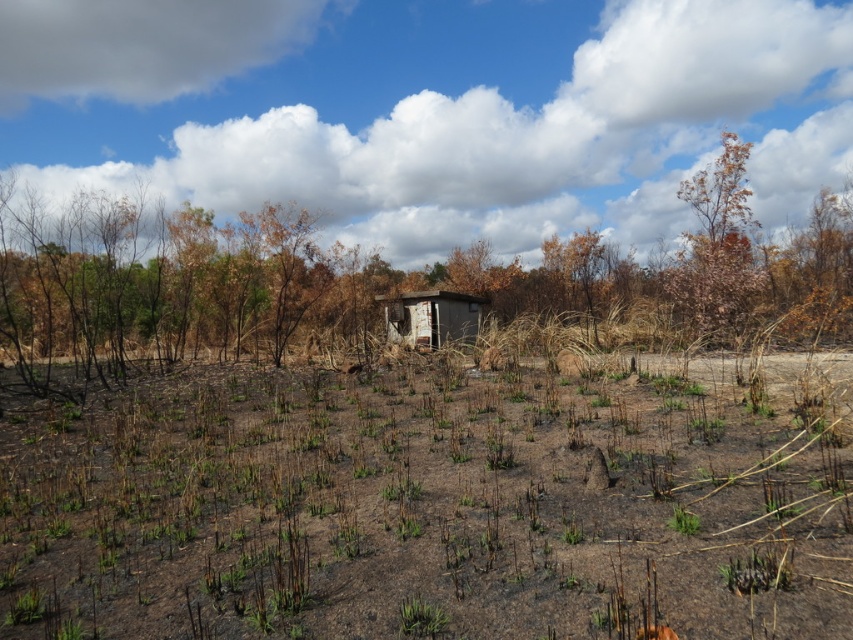
Question: Does white fluffy cloud at upper center appear on the right side of brown dry wood at upper right?

Choices:
 (A) yes
 (B) no

Answer: (B)

Question: Estimate the real-world distances between objects in this image. Which object is closer to the brown dry wood at center?

Choices:
 (A) white fluffy cloud at upper left
 (B) weathered wood hut at center
 (C) white fluffy cloud at upper center

Answer: (B)

Question: Among these points, which one is farthest from the camera?

Choices:
 (A) (253, 342)
 (B) (396, 301)
 (C) (674, 280)

Answer: (B)

Question: In this image, where is white fluffy cloud at upper center located relative to white fluffy cloud at upper left?

Choices:
 (A) left
 (B) right

Answer: (B)

Question: Is brown dry wood at center bigger than weathered wood hut at center?

Choices:
 (A) no
 (B) yes

Answer: (B)

Question: Which of the following is the farthest from the observer?

Choices:
 (A) weathered wood hut at center
 (B) white fluffy cloud at upper left
 (C) white fluffy cloud at upper center
 (D) brown dry wood at upper right

Answer: (B)